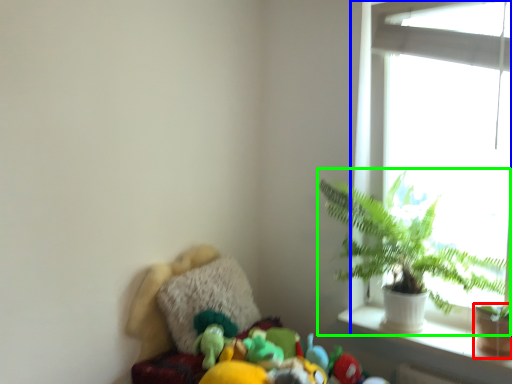
Question: Which object is positioned closest to flowerpot (highlighted by a red box)? Select from window (highlighted by a blue box) and houseplant (highlighted by a green box).

Choices:
 (A) window
 (B) houseplant

Answer: (B)